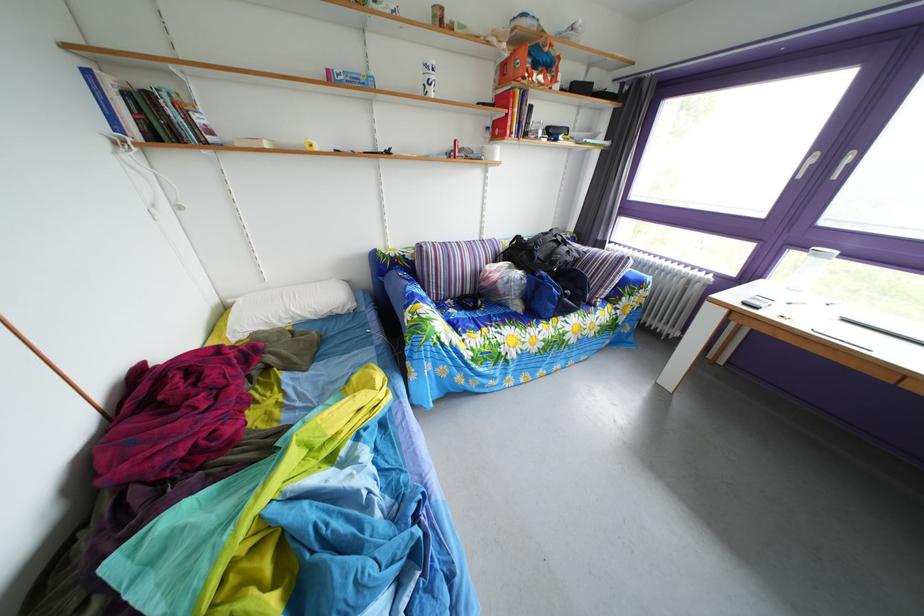
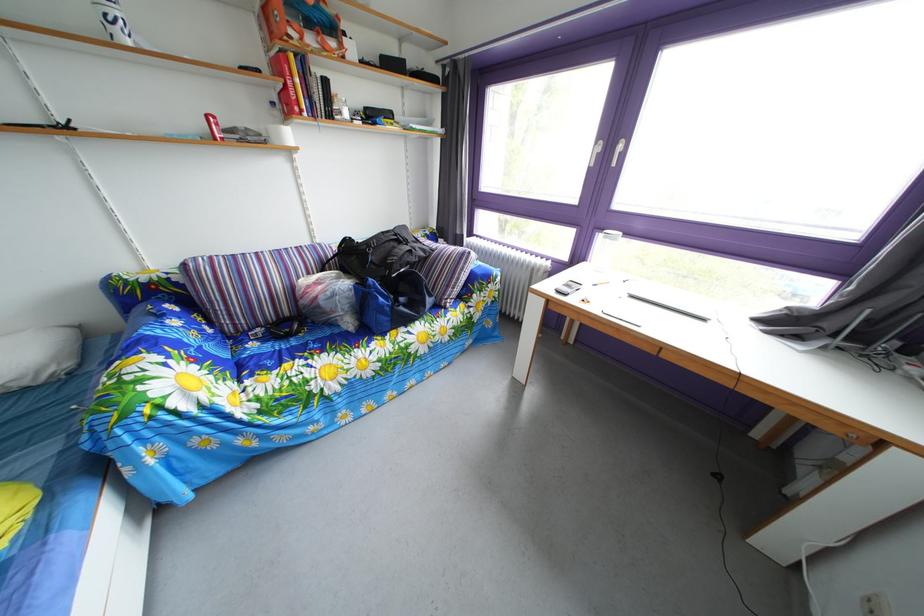
Question: The camera is either moving clockwise (left) or counter-clockwise (right) around the object. The first image is from the beginning of the video and the second image is from the end. Is the camera moving left or right when shooting the video?

Choices:
 (A) Left
 (B) Right

Answer: (A)